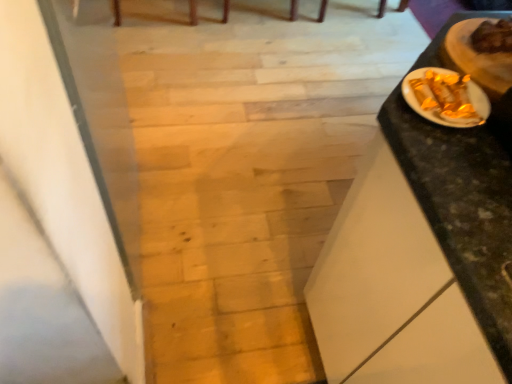
Question: Is point (412, 359) positioned closer to the camera than point (460, 21)?

Choices:
 (A) farther
 (B) closer

Answer: (B)

Question: Is black marble table at right wider or thinner than gold foil wrapped food at right?

Choices:
 (A) wide
 (B) thin

Answer: (A)

Question: Considering the real-world distances, which object is farthest from the wooden floor at center?

Choices:
 (A) gold foil wrapped food at right
 (B) black marble table at right
 (C) golden foil-wrapped food at upper right, the second food positioned from the left
 (D) gold foil candy at right, marked as the 2th food in a top-to-bottom arrangement

Answer: (D)

Question: Estimate the real-world distances between objects in this image. Which object is farther from the black marble table at right?

Choices:
 (A) gold foil wrapped food at right
 (B) gold foil candy at right, which is counted as the 2th food, starting from the right
 (C) wooden floor at center
 (D) golden foil-wrapped food at upper right, acting as the first food starting from the top

Answer: (C)